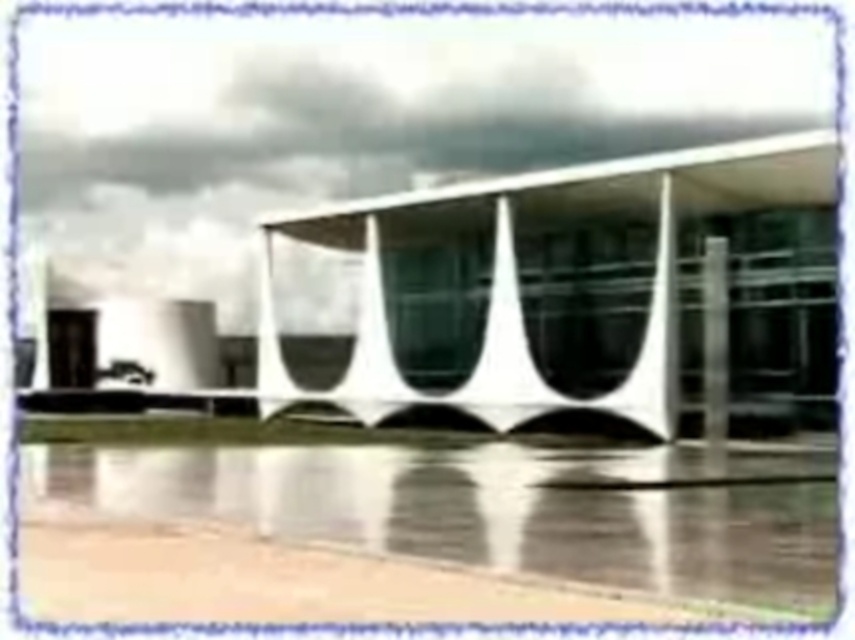
You are standing in front of the modern architectural structure. You see the white glass building at center and the black glass pillar at right. Which object is positioned higher from the ground?

The white glass building at center is above the black glass pillar at right, so it is positioned higher from the ground.